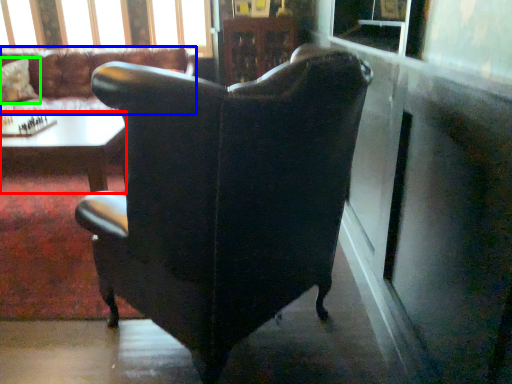
Question: Estimate the real-world distances between objects in this image. Which object is farther from table (highlighted by a red box), chair (highlighted by a blue box) or pillow (highlighted by a green box)?

Choices:
 (A) chair
 (B) pillow

Answer: (B)